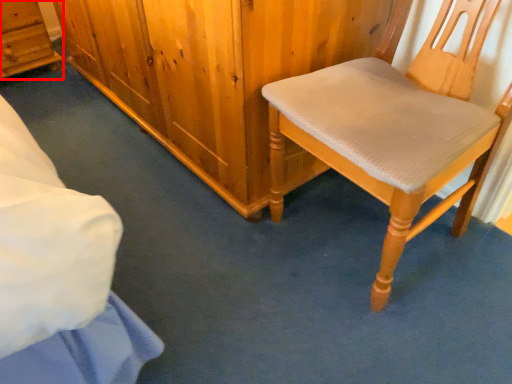
Question: From the image's perspective, where is cabinetry (annotated by the red box) located relative to chair?

Choices:
 (A) below
 (B) above

Answer: (B)